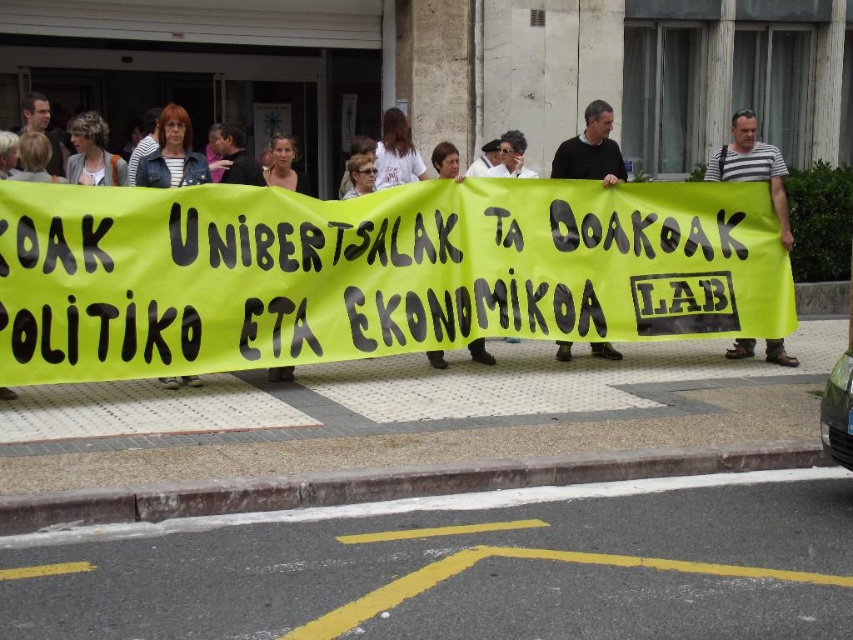
You are a photographer trying to capture both the black sweater at center and the striped fabric jacket at center in a single frame. Based on their sizes, which clothing item would appear closer to the camera?

The black sweater at center has a larger size compared to the striped fabric jacket at center, so it would appear closer to the camera.

You are a photographer standing at the front of the protest group. You want to capture both the striped fabric shirt at center and the striped fabric jacket at center in a single photo. What is the minimum distance you need to move backward to ensure both are fully visible?

The minimum distance you need to move backward is 5.17 meters to ensure both the striped fabric shirt at center and the striped fabric jacket at center are fully visible.

You are a photographer at the protest scene. You want to take a photo of the yellow fabric banner at center without the striped fabric jacket at center blocking it. Is the banner currently visible in your shot?

The yellow fabric banner at center is positioned under the striped fabric jacket at center, so the banner is currently blocked by the jacket and not fully visible in the shot.